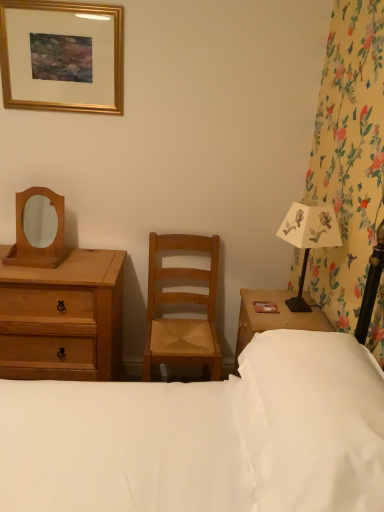
What is the approximate height of white paper lampshade at right?

The height of white paper lampshade at right is 47.23 centimeters.

What do you see at coordinates (312, 422) in the screenshot? The width and height of the screenshot is (384, 512). I see `white soft pillow at lower right` at bounding box center [312, 422].

This screenshot has width=384, height=512. What are the coordinates of `natural wood chair at center` in the screenshot? It's located at (182, 303).

Identify the location of gold wooden picture frame at upper left. The width and height of the screenshot is (384, 512). (62, 56).

From the image's perspective, is natural wood chair at center on top of white fabric bed at center?

Actually, natural wood chair at center appears below white fabric bed at center in the image.

Which is closer, (211,316) or (13,506)?

Clearly, point (211,316) is more distant from the camera than point (13,506).

Is natural wood chair at center at the right side of white fabric bed at center?

Yes.

Does point (338, 232) lie behind point (88, 400)?

Yes, point (338, 232) is behind point (88, 400).

The height and width of the screenshot is (512, 384). In the image, there is a white paper lampshade at right. Find the location of `bed below it (from a real-world perspective)`. bed below it (from a real-world perspective) is located at coordinates (205, 436).

From the image's perspective, which object appears higher, white paper lampshade at right or white fabric bed at center?

white paper lampshade at right is shown above in the image.

Is white paper lampshade at right thinner than white fabric bed at center?

Yes, white paper lampshade at right is thinner than white fabric bed at center.

From a real-world perspective, which is physically below, white paper lampshade at right or white soft pillow at lower right?

From a 3D spatial view, white soft pillow at lower right is below.

Is white paper lampshade at right oriented away from white soft pillow at lower right?

No.

Does white paper lampshade at right have a greater width compared to white soft pillow at lower right?

In fact, white paper lampshade at right might be narrower than white soft pillow at lower right.

Can you confirm if white paper lampshade at right is bigger than white soft pillow at lower right?

Actually, white paper lampshade at right might be smaller than white soft pillow at lower right.

Considering the sizes of objects light brown wooden chest of drawers at left and natural wood chair at center in the image provided, who is smaller, light brown wooden chest of drawers at left or natural wood chair at center?

Smaller between the two is natural wood chair at center.

From a real-world perspective, is light brown wooden chest of drawers at left physically located above or below natural wood chair at center?

From a real-world perspective, light brown wooden chest of drawers at left is physically below natural wood chair at center.

Is point (0, 362) closer or farther from the camera than point (180, 335)?

Point (0, 362).

The width and height of the screenshot is (384, 512). I want to click on chest of drawers below the natural wood chair at center (from the image's perspective), so click(x=63, y=318).

Is gold wooden picture frame at upper left inside the boundaries of white paper lampshade at right, or outside?

gold wooden picture frame at upper left is not enclosed by white paper lampshade at right.

From the image's perspective, relative to white paper lampshade at right, is gold wooden picture frame at upper left above or below?

Clearly, from the image's perspective, gold wooden picture frame at upper left is above white paper lampshade at right.

The width and height of the screenshot is (384, 512). I want to click on bedside lamp on the right of gold wooden picture frame at upper left, so click(308, 238).

Are gold wooden picture frame at upper left and white paper lampshade at right beside each other?

They are not placed beside each other.

Based on the photo, how far apart are gold wooden picture frame at upper left and light brown wooden chest of drawers at left?

gold wooden picture frame at upper left and light brown wooden chest of drawers at left are 38.77 inches apart.

What's the angular difference between gold wooden picture frame at upper left and light brown wooden chest of drawers at left's facing directions?

They differ by 1.81 degrees in their facing directions.

Considering the relative positions of gold wooden picture frame at upper left and light brown wooden chest of drawers at left in the image provided, is gold wooden picture frame at upper left to the left of light brown wooden chest of drawers at left from the viewer's perspective?

No.

Is point (73, 77) positioned in front of point (61, 275)?

No, it is behind (61, 275).

Between natural wood chair at center and wooden mirror at left, which one is positioned behind?

wooden mirror at left is more distant.

Where is `chair beneath the wooden mirror at left (from a real-world perspective)`? chair beneath the wooden mirror at left (from a real-world perspective) is located at coordinates (182, 303).

Is wooden mirror at left inside natural wood chair at center?

No.

From the image's perspective, does natural wood chair at center appear lower than wooden mirror at left?

Yes, from the image's perspective, natural wood chair at center is below wooden mirror at left.

I want to click on chair located underneath the white fabric bed at center (from a real-world perspective), so click(182, 303).

Locate an element on the screen. bedside lamp behind the white fabric bed at center is located at coordinates (308, 238).

Estimate the real-world distances between objects in this image. Which object is further from white paper lampshade at right, white soft pillow at lower right or gold wooden picture frame at upper left?

gold wooden picture frame at upper left.

Which object lies nearer to the anchor point light brown wooden chest of drawers at left, wooden mirror at left or white paper lampshade at right?

Based on the image, wooden mirror at left appears to be nearer to light brown wooden chest of drawers at left.

Considering their positions, is natural wood chair at center positioned closer to wooden mirror at left than light brown wooden chest of drawers at left?

light brown wooden chest of drawers at left.

Which object lies nearer to the anchor point white paper lampshade at right, white fabric bed at center or natural wood chair at center?

Among the two, natural wood chair at center is located nearer to white paper lampshade at right.

Considering their positions, is white soft pillow at lower right positioned closer to light brown wooden chest of drawers at left than white paper lampshade at right?

Among the two, white soft pillow at lower right is located nearer to light brown wooden chest of drawers at left.

Based on their spatial positions, is wooden mirror at left or natural wood chair at center further from white fabric bed at center?

wooden mirror at left is further to white fabric bed at center.

When comparing their distances from white fabric bed at center, does gold wooden picture frame at upper left or white soft pillow at lower right seem closer?

white soft pillow at lower right lies closer to white fabric bed at center than the other object.

Estimate the real-world distances between objects in this image. Which object is closer to white paper lampshade at right, wooden mirror at left or natural wood chair at center?

natural wood chair at center lies closer to white paper lampshade at right than the other object.

Find the location of a particular element. This screenshot has width=384, height=512. picture frame between wooden mirror at left and white paper lampshade at right in the horizontal direction is located at coordinates 62,56.

Where is `bedside lamp between gold wooden picture frame at upper left and white soft pillow at lower right from top to bottom`? The width and height of the screenshot is (384, 512). bedside lamp between gold wooden picture frame at upper left and white soft pillow at lower right from top to bottom is located at coordinates (308, 238).

What are the coordinates of `chair located between light brown wooden chest of drawers at left and white paper lampshade at right in the left-right direction` in the screenshot? It's located at (182, 303).

Where is `the chest of drawers located between white fabric bed at center and wooden mirror at left in the depth direction`? the chest of drawers located between white fabric bed at center and wooden mirror at left in the depth direction is located at coordinates (63, 318).